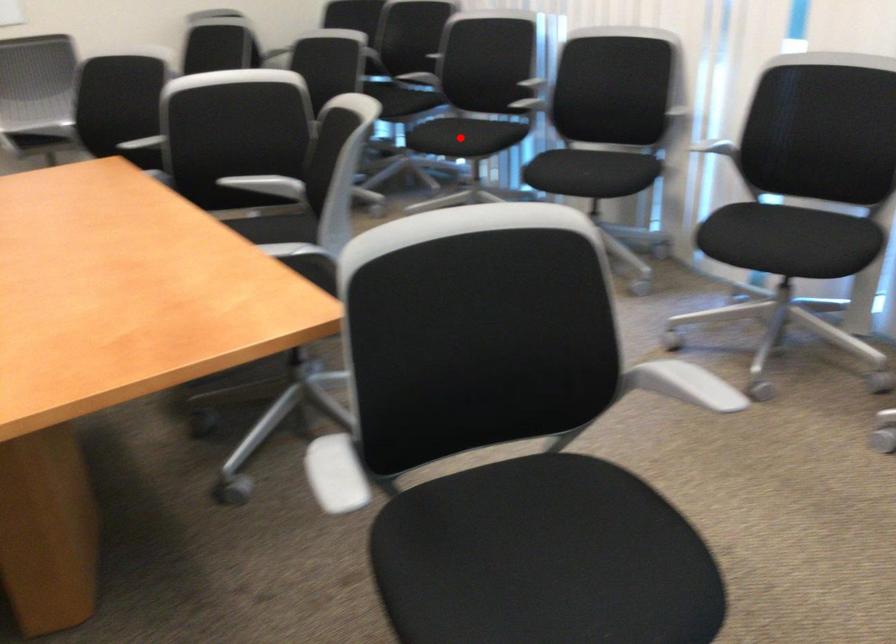
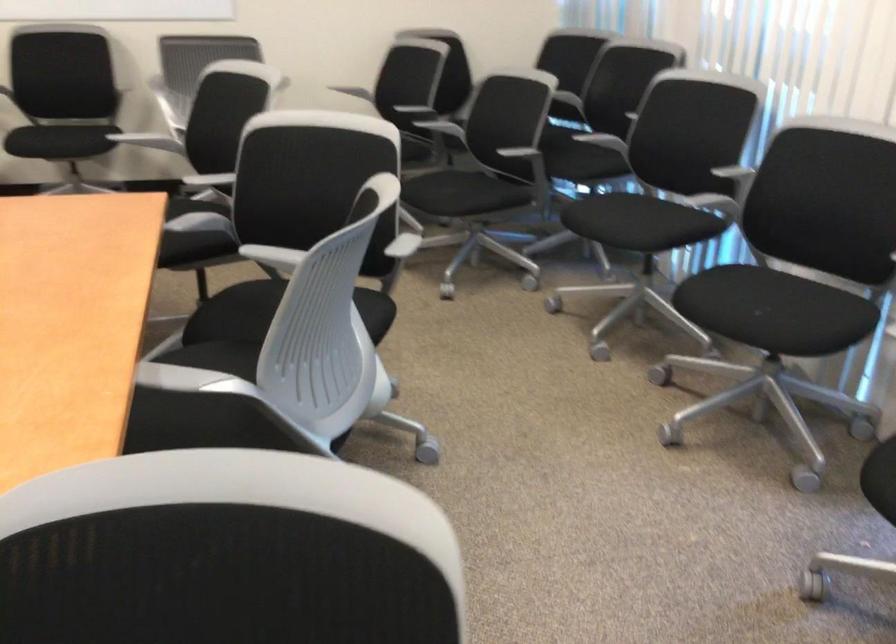
Question: I am providing you with two images of the same scene from different viewpoints. In image1, a red point is highlighted. Considering the same 3D point in image2, which of the following is correct?

Choices:
 (A) It is closer
 (B) It is farther

Answer: (A)